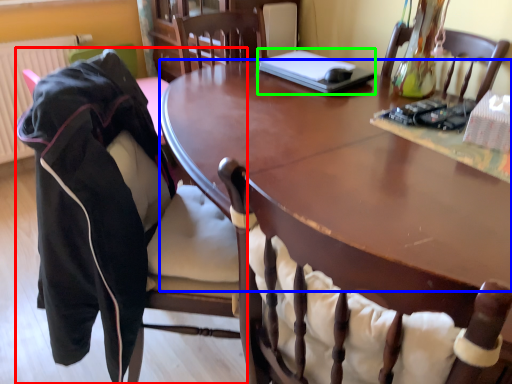
Question: Estimate the real-world distances between objects in this image. Which object is closer to chair (highlighted by a red box), table top (highlighted by a blue box) or laptop (highlighted by a green box)?

Choices:
 (A) table top
 (B) laptop

Answer: (A)